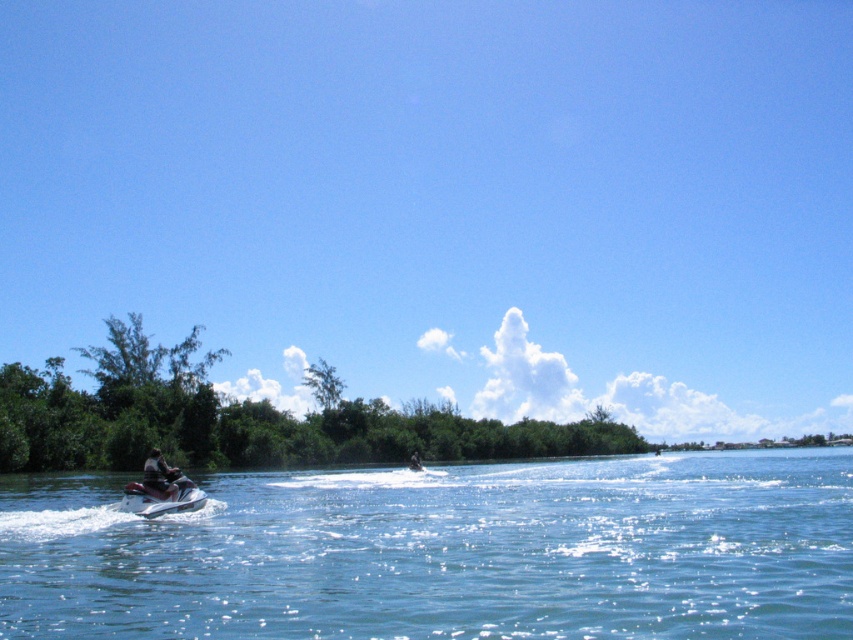
Is blue sky at upper center in front of green leafy tree at center?

Yes, blue sky at upper center is closer to the viewer.

Who is taller, blue sky at upper center or green leafy tree at center?

blue sky at upper center is taller.

The image size is (853, 640). Find the location of `blue sky at upper center`. blue sky at upper center is located at coordinates (445, 200).

Who is higher up, green leafy tree at center or metallic silver jet ski at lower left?

Positioned higher is green leafy tree at center.

Does green leafy tree at center have a greater height compared to metallic silver jet ski at lower left?

In fact, green leafy tree at center may be shorter than metallic silver jet ski at lower left.

This screenshot has height=640, width=853. What do you see at coordinates (323, 384) in the screenshot? I see `green leafy tree at center` at bounding box center [323, 384].

Where is `green leafy tree at center`? The image size is (853, 640). green leafy tree at center is located at coordinates (323, 384).

Who is more forward, (16, 340) or (488, 630)?

Point (488, 630)

Which of these two, blue sky at upper center or clear blue water at center, stands taller?

Standing taller between the two is blue sky at upper center.

Describe the element at coordinates (445, 200) in the screenshot. I see `blue sky at upper center` at that location.

In order to click on blue sky at upper center in this screenshot , I will do click(x=445, y=200).